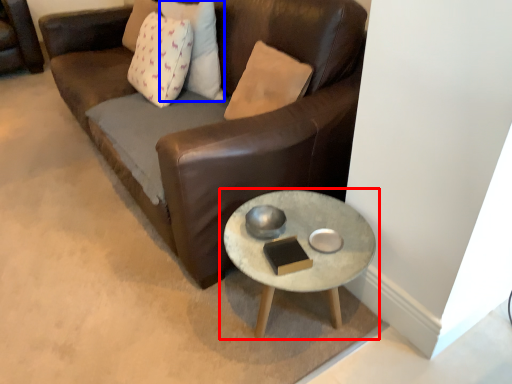
Question: Which object is further to the camera taking this photo, coffee table (highlighted by a red box) or pillow (highlighted by a blue box)?

Choices:
 (A) coffee table
 (B) pillow

Answer: (B)